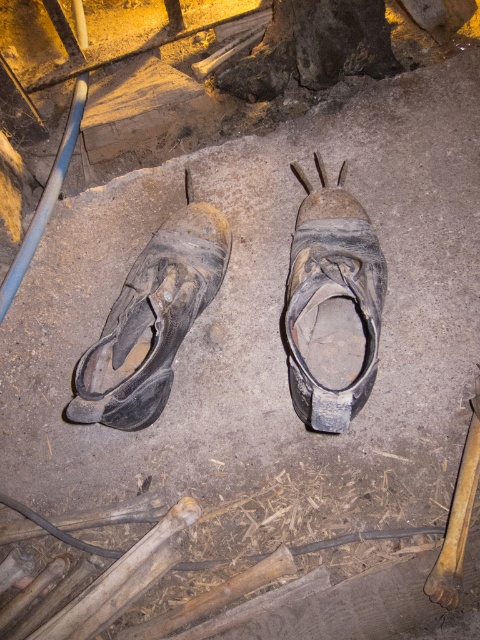
I want to click on worn leather sandal at center, so click(x=333, y=305).

Between point (336, 232) and point (165, 352), which one is positioned behind?

Point (336, 232)

This screenshot has height=640, width=480. What are the coordinates of `worn leather sandal at center` in the screenshot? It's located at (333, 305).